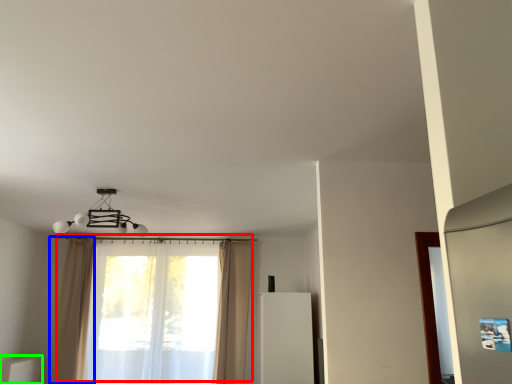
Question: Estimate the real-world distances between objects in this image. Which object is farther from curtain (highlighted by a red box), curtain (highlighted by a blue box) or furniture (highlighted by a green box)?

Choices:
 (A) curtain
 (B) furniture

Answer: (B)